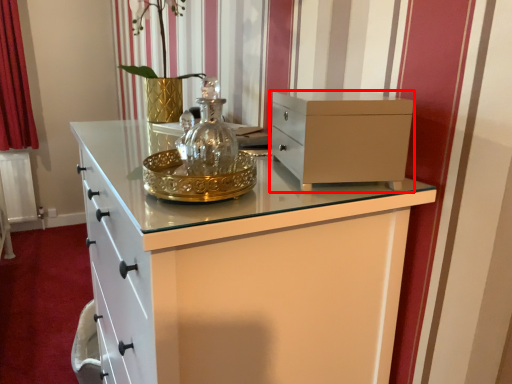
Question: Where is chest of drawers (annotated by the red box) located in relation to curtain in the image?

Choices:
 (A) right
 (B) left

Answer: (A)